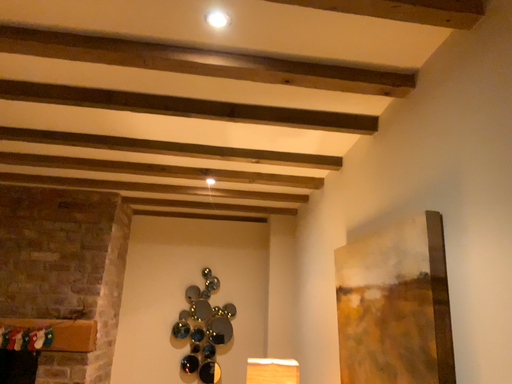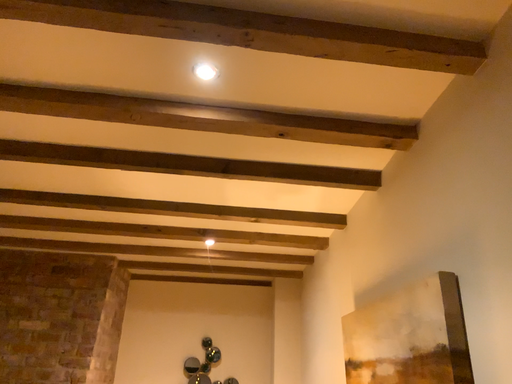
Question: Which way did the camera rotate in the video?

Choices:
 (A) rotated upward
 (B) rotated downward

Answer: (A)